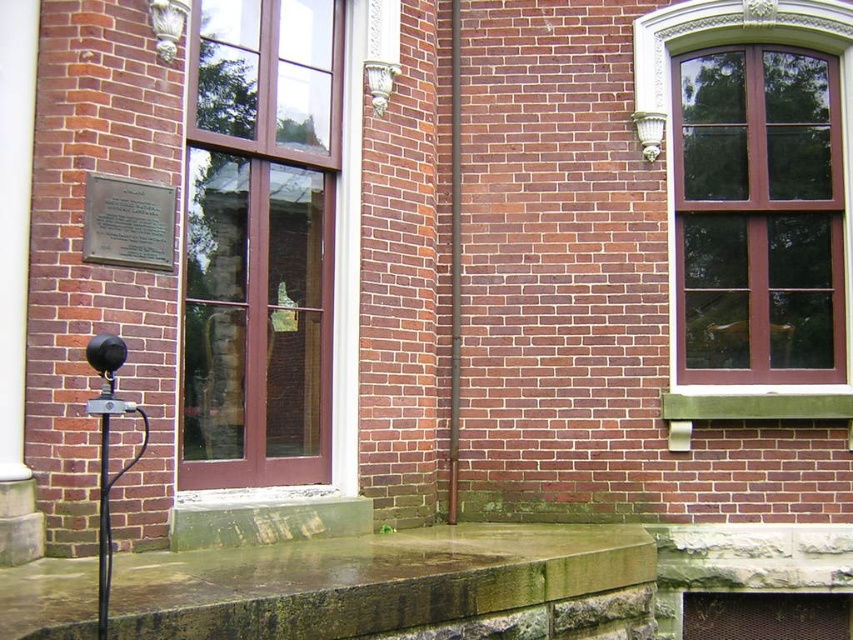
You are a delivery person approaching the brick building and need to place a package on the step in front of the windows. The package must be placed so that it is directly below the matte brown window at upper right. Is the metallic plaque at upper left in a position that could interfere with placing the package there?

The matte brown window at upper right is positioned over the metallic plaque at upper left, so placing the package directly below the matte brown window at upper right would place it over the metallic plaque at upper left. Therefore, the metallic plaque at upper left is in a position that could interfere with placing the package there.

You are a painter standing at the base of the building, looking up at the matte brown window at upper right and the smooth brown pole at center. Which object is closer to you?

The matte brown window at upper right is closer to you because it is in front of the smooth brown pole at center.

You are a delivery person trying to enter the building. You see the matte glass door at center and the smooth brown pole at center. Which object should you approach first to reach the entrance?

The smooth brown pole at center is located below the matte glass door at center, so you should approach the smooth brown pole at center first to reach the entrance.